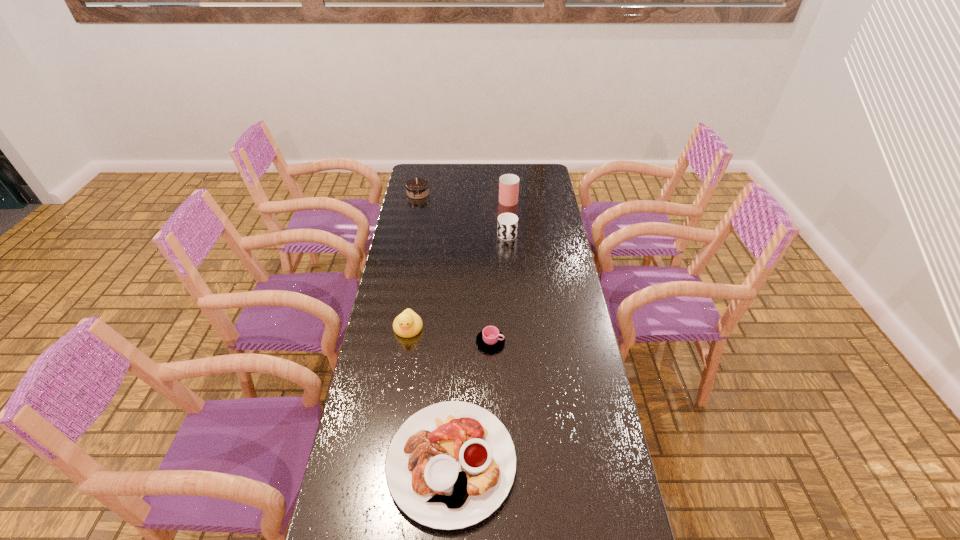
In order to click on the farthest cup in this screenshot , I will do `click(508, 184)`.

Where is `the tallest cup`? Image resolution: width=960 pixels, height=540 pixels. the tallest cup is located at coordinates (508, 184).

Find the location of a particular element. The image size is (960, 540). chocolate cake is located at coordinates (417, 188).

Locate an element on the screen. The height and width of the screenshot is (540, 960). the second tallest cup is located at coordinates (507, 228).

This screenshot has width=960, height=540. Identify the location of the second nearest cup. (507, 228).

Where is `duckling`? duckling is located at coordinates (408, 324).

In order to click on the nearest cup in this screenshot , I will do `click(490, 338)`.

Where is `platter`? The image size is (960, 540). platter is located at coordinates (450, 465).

Locate an element on the screen. The width and height of the screenshot is (960, 540). free region located 0.140m on the side of the tallest object with the handle is located at coordinates (506, 176).

This screenshot has height=540, width=960. In order to click on free spot located on the side of the tallest object with the handle in this screenshot , I will do tap(505, 164).